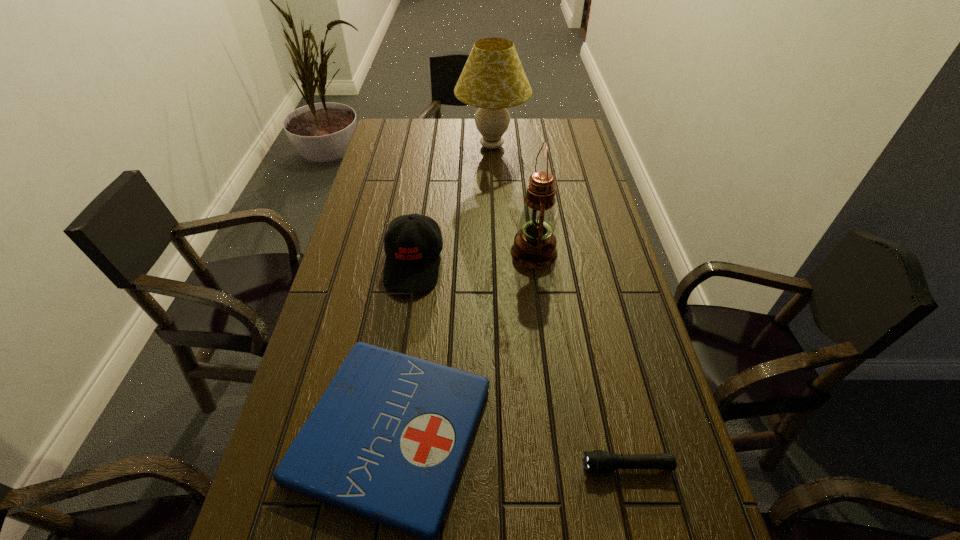
Locate an element on the screen. The height and width of the screenshot is (540, 960). object located in the far edge section of the desktop is located at coordinates pyautogui.click(x=493, y=79).

Image resolution: width=960 pixels, height=540 pixels. What are the coordinates of `object situated at the left edge` in the screenshot? It's located at (412, 263).

Where is `object present at the right edge`? This screenshot has height=540, width=960. object present at the right edge is located at coordinates (598, 461).

Locate an element on the screen. Image resolution: width=960 pixels, height=540 pixels. vacant area at the far edge is located at coordinates (515, 130).

Locate an element on the screen. vacant region at the left edge of the desktop is located at coordinates (361, 212).

You are a GUI agent. You are given a task and a screenshot of the screen. Output one action in this format:
    pyautogui.click(x=<x>, y=<y>)
    Task: Click on the vacant space at the right edge of the desktop
    The width and height of the screenshot is (960, 540).
    Given the screenshot: What is the action you would take?
    pyautogui.click(x=593, y=176)

I want to click on blank area at the far left corner, so click(400, 132).

Locate an element on the screen. The width and height of the screenshot is (960, 540). empty space that is in between the third tallest object and the oil lamp is located at coordinates (474, 258).

Find the location of `empty location between the oil lamp and the baseball cap`. empty location between the oil lamp and the baseball cap is located at coordinates (474, 258).

Find the location of a particular element. The image size is (960, 540). vacant space in between the flashlight and the lampshade is located at coordinates (x=560, y=306).